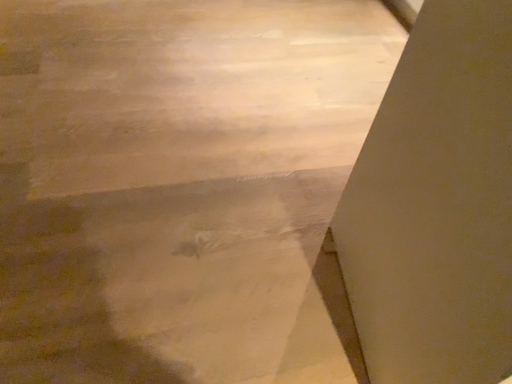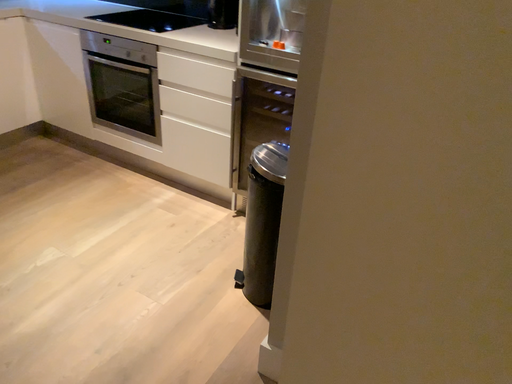
Question: How did the camera likely rotate when shooting the video?

Choices:
 (A) rotated left
 (B) rotated right

Answer: (B)